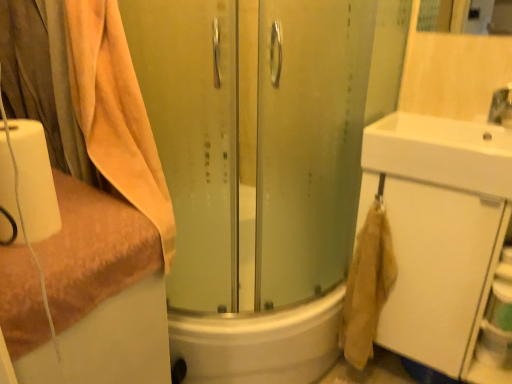
Question: Is orange terry cloth towel at left, the second towel viewed from the top, spatially inside white matte toilet paper at left, or outside of it?

Choices:
 (A) outside
 (B) inside

Answer: (A)

Question: Does point (129, 231) appear closer or farther from the camera than point (45, 223)?

Choices:
 (A) closer
 (B) farther

Answer: (B)

Question: Estimate the real-world distances between objects in this image. Which object is closer to the beige cotton towel at left, acting as the first towel starting from the top?

Choices:
 (A) beige cotton towel at lower right
 (B) orange terry cloth towel at left, the second towel viewed from the top
 (C) white glossy sink at upper right
 (D) white matte cabinet at right
 (E) white matte toilet paper at left

Answer: (B)

Question: Based on their relative distances, which object is farther from the beige cotton towel at left, acting as the 2th towel starting from the bottom?

Choices:
 (A) white matte cabinet at right
 (B) beige cotton towel at lower right
 (C) white matte toilet paper at left
 (D) white glossy sink at upper right
 (E) orange terry cloth towel at left, the second towel viewed from the top

Answer: (A)